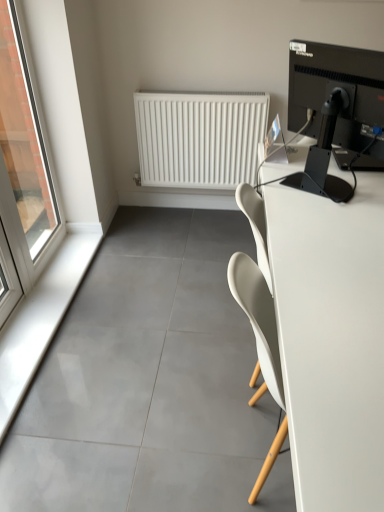
Question: Does black glossy monitor at upper right lie behind white glossy window sill at lower left?

Choices:
 (A) yes
 (B) no

Answer: (B)

Question: From the image's perspective, does black glossy monitor at upper right appear higher than white glossy window sill at lower left?

Choices:
 (A) no
 (B) yes

Answer: (B)

Question: Is black glossy monitor at upper right to the right of white glossy window sill at lower left from the viewer's perspective?

Choices:
 (A) yes
 (B) no

Answer: (A)

Question: Is black glossy monitor at upper right placed right next to white glossy window sill at lower left?

Choices:
 (A) yes
 (B) no

Answer: (B)

Question: Can you confirm if black glossy monitor at upper right is smaller than white glossy window sill at lower left?

Choices:
 (A) no
 (B) yes

Answer: (A)

Question: Is white glossy window sill at lower left wider or thinner than white matte radiator at upper center?

Choices:
 (A) wide
 (B) thin

Answer: (A)

Question: Considering the relative positions of white glossy window sill at lower left and white matte radiator at upper center in the image provided, is white glossy window sill at lower left to the left or to the right of white matte radiator at upper center?

Choices:
 (A) right
 (B) left

Answer: (B)

Question: From a real-world perspective, relative to white matte radiator at upper center, is white glossy window sill at lower left vertically above or below?

Choices:
 (A) below
 (B) above

Answer: (A)

Question: Based on their sizes in the image, would you say white glossy window sill at lower left is bigger or smaller than white matte radiator at upper center?

Choices:
 (A) big
 (B) small

Answer: (B)

Question: From a real-world perspective, is white matte desk at right positioned above or below white matte radiator at upper center?

Choices:
 (A) above
 (B) below

Answer: (B)

Question: Is white matte desk at right wider or thinner than white matte radiator at upper center?

Choices:
 (A) thin
 (B) wide

Answer: (B)

Question: Looking at the image, does white matte desk at right seem bigger or smaller compared to white matte radiator at upper center?

Choices:
 (A) small
 (B) big

Answer: (B)

Question: Visually, is white matte desk at right positioned to the left or to the right of white matte radiator at upper center?

Choices:
 (A) left
 (B) right

Answer: (B)

Question: Considering the positions of white matte radiator at upper center and transparent glass window at left in the image, is white matte radiator at upper center taller or shorter than transparent glass window at left?

Choices:
 (A) tall
 (B) short

Answer: (B)

Question: In the image, is white matte radiator at upper center positioned in front of or behind transparent glass window at left?

Choices:
 (A) front
 (B) behind

Answer: (B)